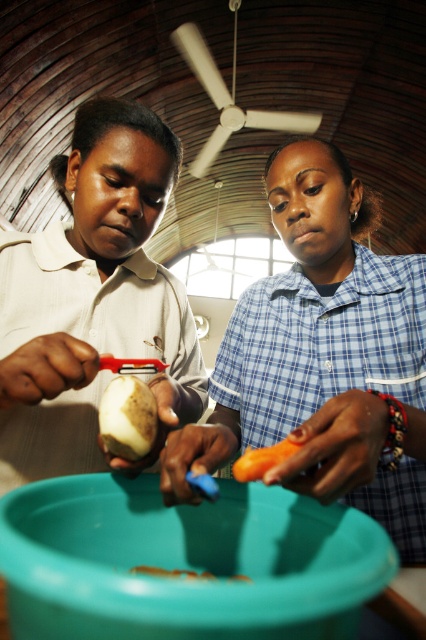
Question: Is matte white potato at left thinner than orange smooth carrot at center?

Choices:
 (A) no
 (B) yes

Answer: (A)

Question: Estimate the real-world distances between objects in this image. Which object is farther from the matte blue shirt at center?

Choices:
 (A) matte white potato at left
 (B) orange smooth carrot at center

Answer: (B)

Question: Is smooth white potato at center to the left of orange smooth carrot at lower center from the viewer's perspective?

Choices:
 (A) yes
 (B) no

Answer: (A)

Question: Estimate the real-world distances between objects in this image. Which object is closer to the smooth white potato at center?

Choices:
 (A) matte white potato at left
 (B) orange smooth carrot at lower center
 (C) matte blue shirt at center

Answer: (B)

Question: Which of the following is the closest to the observer?

Choices:
 (A) smooth white potato at center
 (B) orange smooth carrot at center
 (C) orange smooth carrot at lower center

Answer: (B)

Question: Is matte white potato at left thinner than orange smooth carrot at lower center?

Choices:
 (A) no
 (B) yes

Answer: (A)